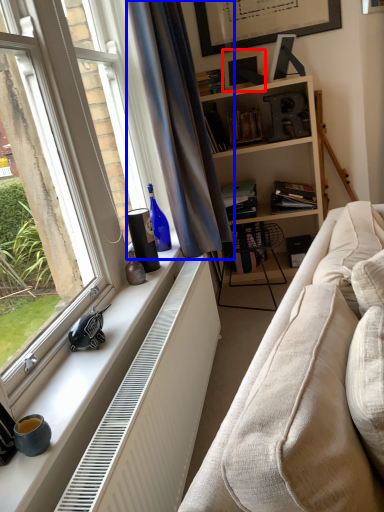
Question: Which object appears farthest to the camera in this image, picture frame (highlighted by a red box) or curtain (highlighted by a blue box)?

Choices:
 (A) picture frame
 (B) curtain

Answer: (A)